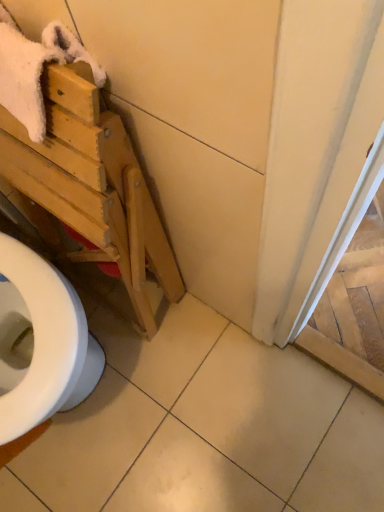
Question: From the image's perspective, does light wood folding chair at left appear lower than white tile at center?

Choices:
 (A) no
 (B) yes

Answer: (A)

Question: Does light wood folding chair at left appear on the right side of white tile at center?

Choices:
 (A) yes
 (B) no

Answer: (B)

Question: Is light wood folding chair at left positioned behind white tile at center?

Choices:
 (A) yes
 (B) no

Answer: (B)

Question: Is light wood folding chair at left not within white tile at center?

Choices:
 (A) no
 (B) yes

Answer: (B)

Question: Does light wood folding chair at left have a smaller size compared to white tile at center?

Choices:
 (A) yes
 (B) no

Answer: (B)

Question: Is white tile at center to the left or to the right of white fluffy bath towel at upper left in the image?

Choices:
 (A) right
 (B) left

Answer: (A)

Question: From their relative heights in the image, would you say white tile at center is taller or shorter than white fluffy bath towel at upper left?

Choices:
 (A) tall
 (B) short

Answer: (B)

Question: From a real-world perspective, is white tile at center positioned above or below white fluffy bath towel at upper left?

Choices:
 (A) above
 (B) below

Answer: (B)

Question: Does point (218, 509) appear closer or farther from the camera than point (4, 97)?

Choices:
 (A) farther
 (B) closer

Answer: (A)

Question: Which is correct: white tile at center is inside light wood folding chair at left, or outside of it?

Choices:
 (A) inside
 (B) outside

Answer: (B)

Question: Does point (100, 435) appear closer or farther from the camera than point (168, 269)?

Choices:
 (A) closer
 (B) farther

Answer: (B)

Question: Looking at their shapes, would you say white tile at center is wider or thinner than light wood folding chair at left?

Choices:
 (A) thin
 (B) wide

Answer: (B)

Question: From a real-world perspective, is white tile at center above or below light wood folding chair at left?

Choices:
 (A) above
 (B) below

Answer: (B)

Question: From the image's perspective, is white fluffy bath towel at upper left positioned above or below white tile at center?

Choices:
 (A) below
 (B) above

Answer: (B)

Question: Relative to white tile at center, is white fluffy bath towel at upper left in front or behind?

Choices:
 (A) behind
 (B) front

Answer: (B)